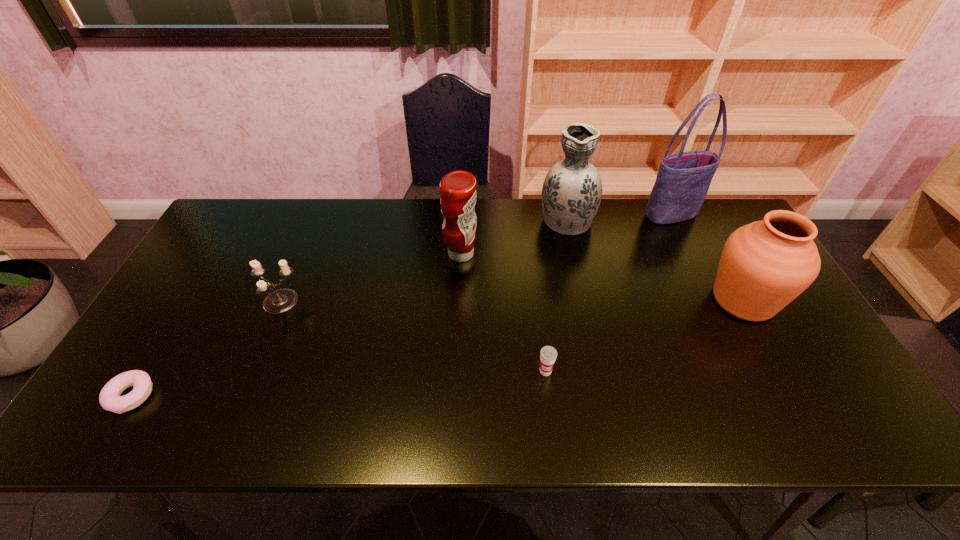
Locate an element on the screen. This screenshot has height=540, width=960. vacant space in between the third shortest object and the third object from left to right is located at coordinates [371, 279].

Point out which object is positioned as the nearest to the urn. Please provide its 2D coordinates. Your answer should be formatted as a tuple, i.e. [(x, y)], where the tuple contains the x and y coordinates of a point satisfying the conditions above.

[(683, 180)]

Select which object appears as the fifth closest to the tote bag. Please provide its 2D coordinates. Your answer should be formatted as a tuple, i.e. [(x, y)], where the tuple contains the x and y coordinates of a point satisfying the conditions above.

[(281, 300)]

At what (x,y) coordinates should I click in order to perform the action: click on vacant space that satisfies the following two spatial constraints: 1. on the back side of the fifth object from right to left; 2. on the right side of the doughnut. Please return your answer as a coordinate pair (x, y). Image resolution: width=960 pixels, height=540 pixels. Looking at the image, I should click on (217, 254).